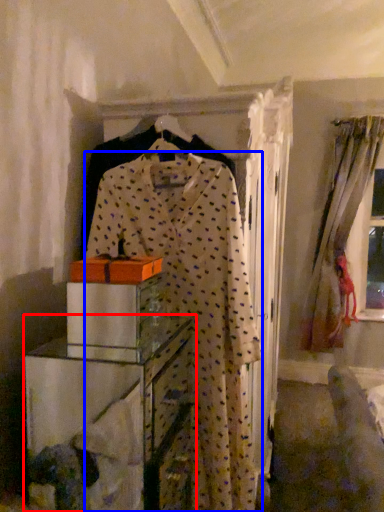
Question: Among these objects, which one is farthest to the camera, furniture (highlighted by a red box) or fancy dress (highlighted by a blue box)?

Choices:
 (A) furniture
 (B) fancy dress

Answer: (B)